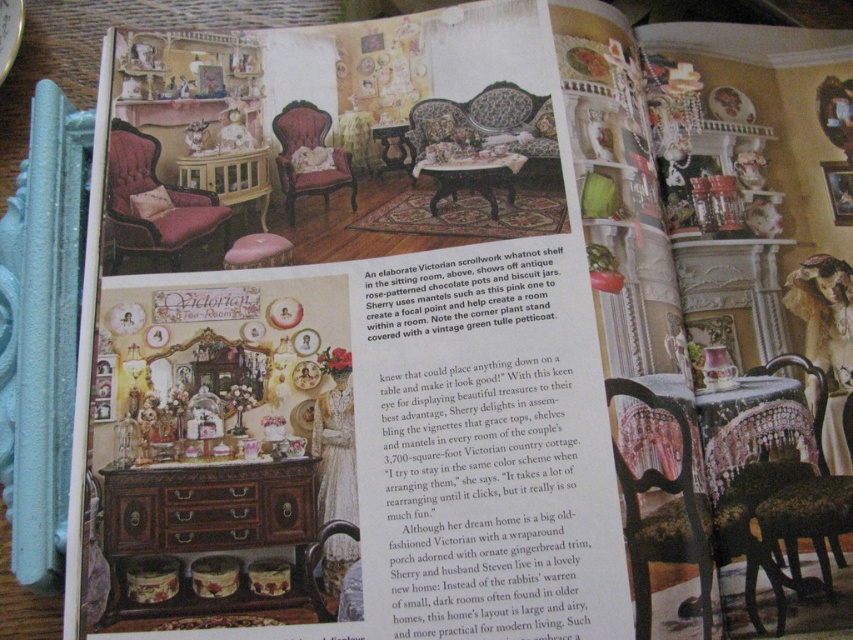
Question: Which point is farther to the camera?

Choices:
 (A) (109, 236)
 (B) (250, 156)

Answer: (B)

Question: Considering the relative positions of velvet pink armchair at center and matte wood table at center in the image provided, where is velvet pink armchair at center located with respect to matte wood table at center?

Choices:
 (A) below
 (B) above

Answer: (B)

Question: Is black lace table at center closer to camera compared to wooden table at center?

Choices:
 (A) yes
 (B) no

Answer: (A)

Question: Which is nearer to the black lace table at center?

Choices:
 (A) wooden dresser at lower left
 (B) floral-patterned fabric sofa at center

Answer: (A)

Question: Can you confirm if wooden dresser at lower left is positioned above matte wood table at center?

Choices:
 (A) yes
 (B) no

Answer: (B)

Question: Which object is farther from the camera taking this photo?

Choices:
 (A) floral-patterned fabric sofa at center
 (B) velvet pink armchair at center

Answer: (B)